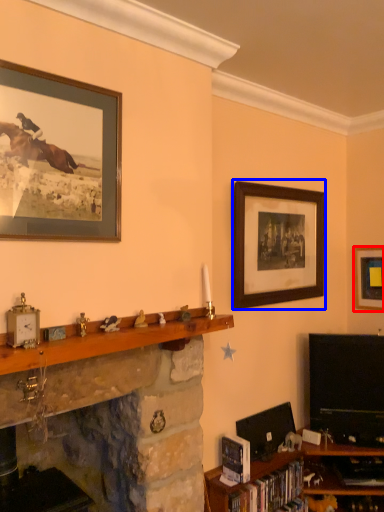
Question: Which of the following is the closest to the observer, picture frame (highlighted by a red box) or picture frame (highlighted by a blue box)?

Choices:
 (A) picture frame
 (B) picture frame

Answer: (B)